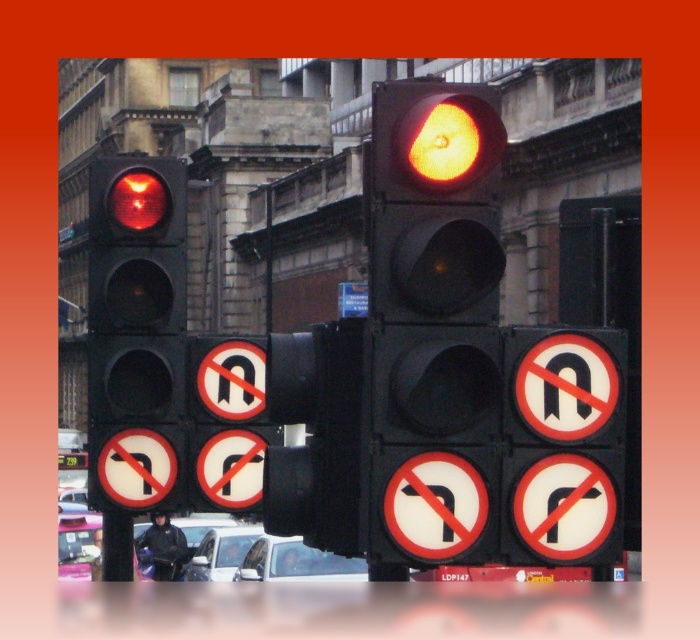
Can you confirm if matte black traffic light at left is smaller than white circular sign at center?

No, matte black traffic light at left is not smaller than white circular sign at center.

Which is in front, point (168, 353) or point (252, 356)?

Point (168, 353) is in front.

The height and width of the screenshot is (640, 700). Find the location of `matte black traffic light at left`. matte black traffic light at left is located at coordinates pyautogui.click(x=134, y=317).

Which is in front, point (412, 157) or point (224, 356)?

Positioned in front is point (412, 157).

At what (x,y) coordinates should I click in order to perform the action: click on matte black traffic light at center. Please return your answer as a coordinate pair (x, y). This screenshot has height=640, width=700. Looking at the image, I should click on (434, 312).

Where is `matte black traffic light at center`? This screenshot has width=700, height=640. matte black traffic light at center is located at coordinates (434, 312).

This screenshot has width=700, height=640. I want to click on matte black traffic light at center, so click(x=434, y=312).

Is matte black traffic light at center to the left of matte black traffic light at left from the viewer's perspective?

In fact, matte black traffic light at center is to the right of matte black traffic light at left.

Is matte black traffic light at center closer to camera compared to matte black traffic light at left?

Yes, it is.

Locate an element on the screen. matte black traffic light at center is located at coordinates (434, 312).

In order to click on matte black traffic light at center in this screenshot , I will do tap(434, 312).